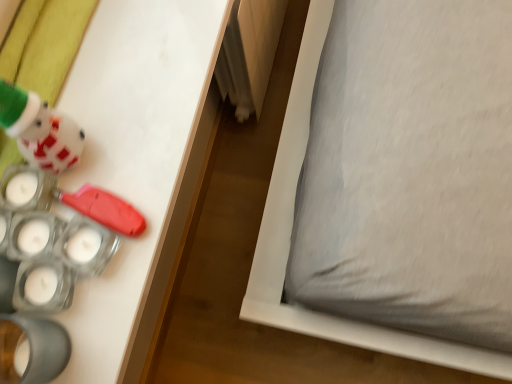
Question: From the image's perspective, is translucent plastic candle holder at lower left, which is the second toy from top to bottom, located beneath matte white plush at upper left, placed as the second toy when sorted from bottom to top?

Choices:
 (A) yes
 (B) no

Answer: (A)

Question: From the image's perspective, is translucent plastic candle holder at lower left, which is counted as the first toy, starting from the bottom, over matte white plush at upper left, placed as the second toy when sorted from bottom to top?

Choices:
 (A) no
 (B) yes

Answer: (A)

Question: Does translucent plastic candle holder at lower left, which is the second toy from top to bottom, have a lesser height compared to matte white plush at upper left, which is the first toy in top-to-bottom order?

Choices:
 (A) no
 (B) yes

Answer: (B)

Question: Considering the relative sizes of translucent plastic candle holder at lower left, which is the second toy from top to bottom, and matte white plush at upper left, which is the first toy in top-to-bottom order, in the image provided, is translucent plastic candle holder at lower left, which is the second toy from top to bottom, taller than matte white plush at upper left, which is the first toy in top-to-bottom order,?

Choices:
 (A) yes
 (B) no

Answer: (B)

Question: Could you tell me if translucent plastic candle holder at lower left, which is counted as the first toy, starting from the bottom, is turned towards matte white plush at upper left, placed as the second toy when sorted from bottom to top?

Choices:
 (A) no
 (B) yes

Answer: (A)

Question: Does translucent plastic candle holder at lower left, which is counted as the first toy, starting from the bottom, appear on the left side of matte white plush at upper left, placed as the second toy when sorted from bottom to top?

Choices:
 (A) yes
 (B) no

Answer: (B)

Question: Does translucent plastic candle holder at lower left, which is counted as the first toy, starting from the bottom, have a lesser height compared to gray fabric pillow at lower right?

Choices:
 (A) no
 (B) yes

Answer: (A)

Question: From a real-world perspective, is translucent plastic candle holder at lower left, which is the second toy from top to bottom, on top of gray fabric pillow at lower right?

Choices:
 (A) yes
 (B) no

Answer: (A)

Question: Is translucent plastic candle holder at lower left, which is the second toy from top to bottom, at the left side of gray fabric pillow at lower right?

Choices:
 (A) no
 (B) yes

Answer: (B)

Question: Is translucent plastic candle holder at lower left, which is counted as the first toy, starting from the bottom, aimed at gray fabric pillow at lower right?

Choices:
 (A) no
 (B) yes

Answer: (A)

Question: Is gray fabric pillow at lower right a part of translucent plastic candle holder at lower left, which is counted as the first toy, starting from the bottom?

Choices:
 (A) no
 (B) yes

Answer: (A)

Question: Are translucent plastic candle holder at lower left, which is counted as the first toy, starting from the bottom, and gray fabric pillow at lower right making contact?

Choices:
 (A) yes
 (B) no

Answer: (B)

Question: Would you say translucent plastic candle holder at lower left, which is the second toy from top to bottom, is part of matte white plush at upper left, which is the first toy in top-to-bottom order,'s contents?

Choices:
 (A) yes
 (B) no

Answer: (B)